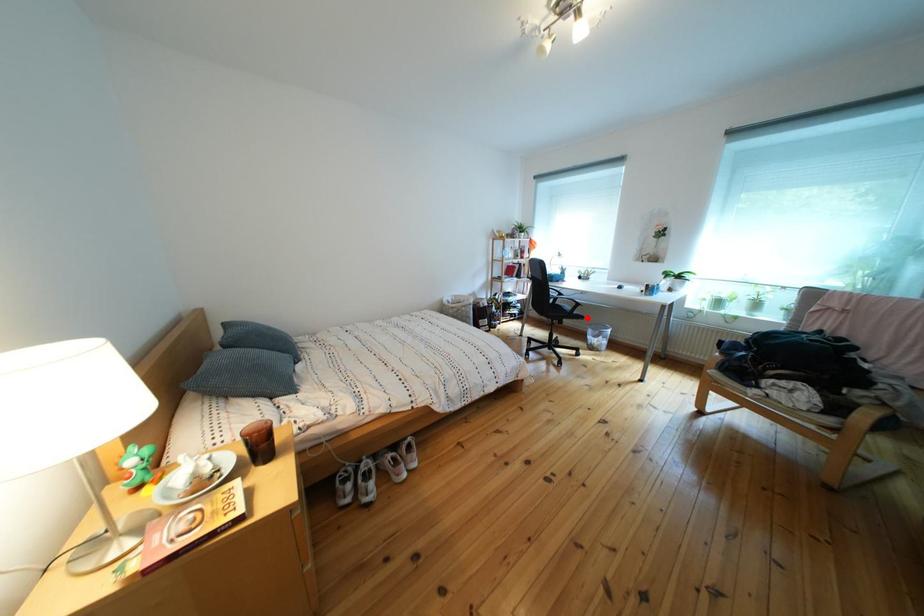
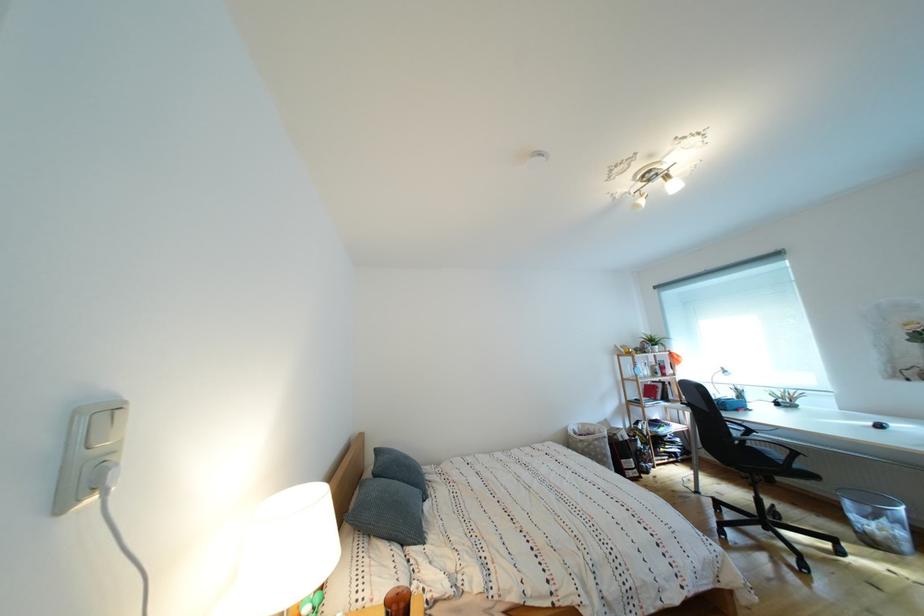
Question: I am providing you with two images of the same scene from different viewpoints. A red point is marked on the first image. At the location where the point appears in image 1, is it still visible in image 2?

Choices:
 (A) Yes
 (B) No

Answer: (A)